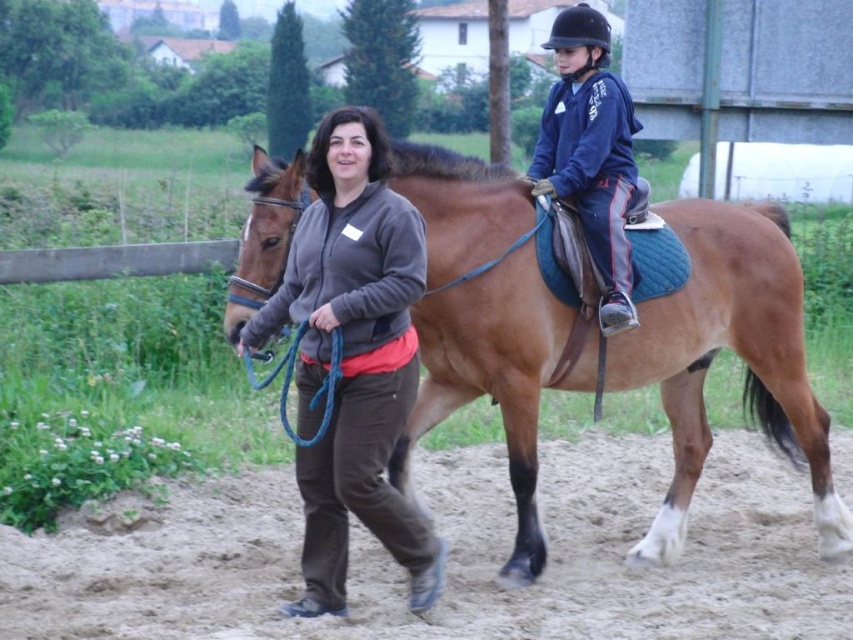
Question: Is brown leather saddle at center closer to the viewer compared to blue fleece jacket at upper center?

Choices:
 (A) no
 (B) yes

Answer: (B)

Question: Does brown sandy dirt track at lower center have a greater width compared to blue fleece jacket at upper center?

Choices:
 (A) yes
 (B) no

Answer: (A)

Question: Based on their relative distances, which object is nearer to the dark gray fleece jacket at center?

Choices:
 (A) blue fleece jacket at upper center
 (B) brown leather saddle at center

Answer: (B)

Question: Is dark gray fleece jacket at center below blue fleece jacket at upper center?

Choices:
 (A) no
 (B) yes

Answer: (B)

Question: Among these points, which one is farthest from the camera?

Choices:
 (A) (122, 532)
 (B) (590, 36)
 (C) (309, 435)
 (D) (701, 260)

Answer: (A)

Question: Which point is farther from the camera taking this photo?

Choices:
 (A) (0, 584)
 (B) (606, 385)
 (C) (608, 298)

Answer: (B)